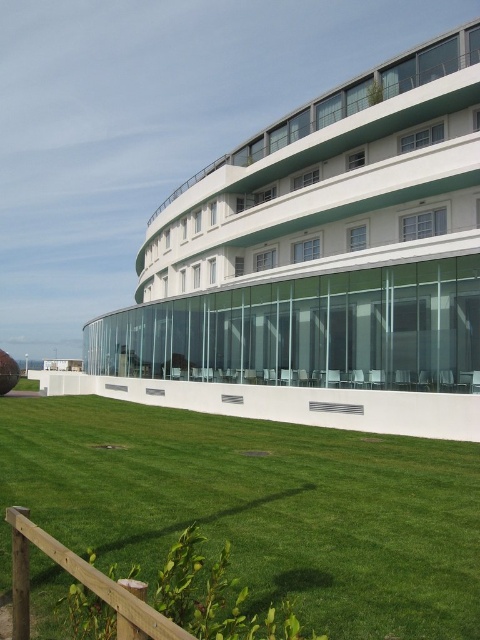
Question: Is white glass building at center smaller than green grass at lower center?

Choices:
 (A) yes
 (B) no

Answer: (B)

Question: Which point is farther to the camera?

Choices:
 (A) (249, 502)
 (B) (255, 333)

Answer: (B)

Question: Is white glass building at center below green grass at lower center?

Choices:
 (A) yes
 (B) no

Answer: (B)

Question: Can you confirm if white glass building at center is positioned to the left of green grass at lower center?

Choices:
 (A) yes
 (B) no

Answer: (A)

Question: Which object is closer to the camera taking this photo?

Choices:
 (A) green grass at lower center
 (B) white glass building at center

Answer: (A)